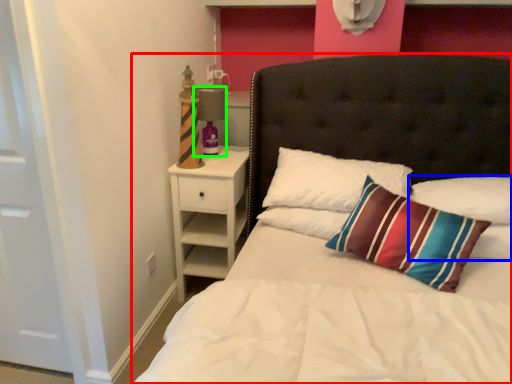
Question: Based on their relative distances, which object is nearer to bed (highlighted by a red box)? Choose from pillow (highlighted by a blue box) and lamp (highlighted by a green box).

Choices:
 (A) pillow
 (B) lamp

Answer: (A)